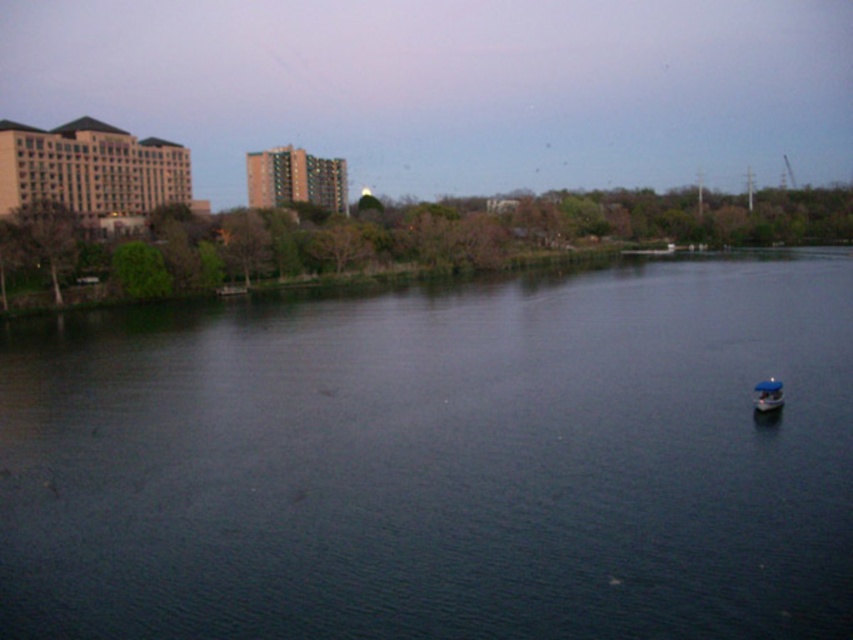
Does dark blue water at center have a greater height compared to blue matte boat at lower right?

Indeed, dark blue water at center has a greater height compared to blue matte boat at lower right.

Is dark blue water at center positioned in front of blue matte boat at lower right?

Yes, it is in front of blue matte boat at lower right.

Between point (309, 349) and point (755, 385), which one is positioned behind?

Point (309, 349)

Find the location of a particular element. dark blue water at center is located at coordinates (440, 461).